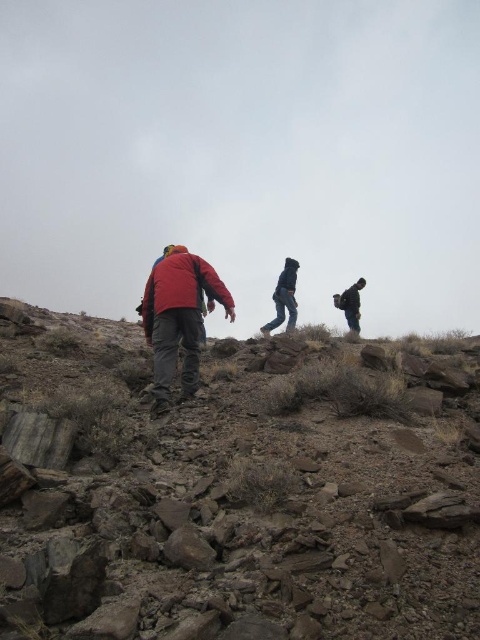
Can you confirm if rusty stone hillside at lower left is bigger than red matte jacket at center?

Correct, rusty stone hillside at lower left is larger in size than red matte jacket at center.

I want to click on rusty stone hillside at lower left, so click(230, 492).

Does red matte jacket at center appear on the left side of dark gray fabric backpack at right?

Yes, red matte jacket at center is to the left of dark gray fabric backpack at right.

Is point (159, 371) positioned behind point (347, 296)?

No.

The width and height of the screenshot is (480, 640). What are the coordinates of `red matte jacket at center` in the screenshot? It's located at (179, 317).

Is the position of rusty stone hillside at lower left less distant than that of dark gray fabric backpack at right?

Yes, rusty stone hillside at lower left is closer to the viewer.

Which is above, rusty stone hillside at lower left or dark gray fabric backpack at right?

dark gray fabric backpack at right is higher up.

Between point (239, 360) and point (348, 317), which one is positioned behind?

The point (348, 317) is more distant.

I want to click on rusty stone hillside at lower left, so click(x=230, y=492).